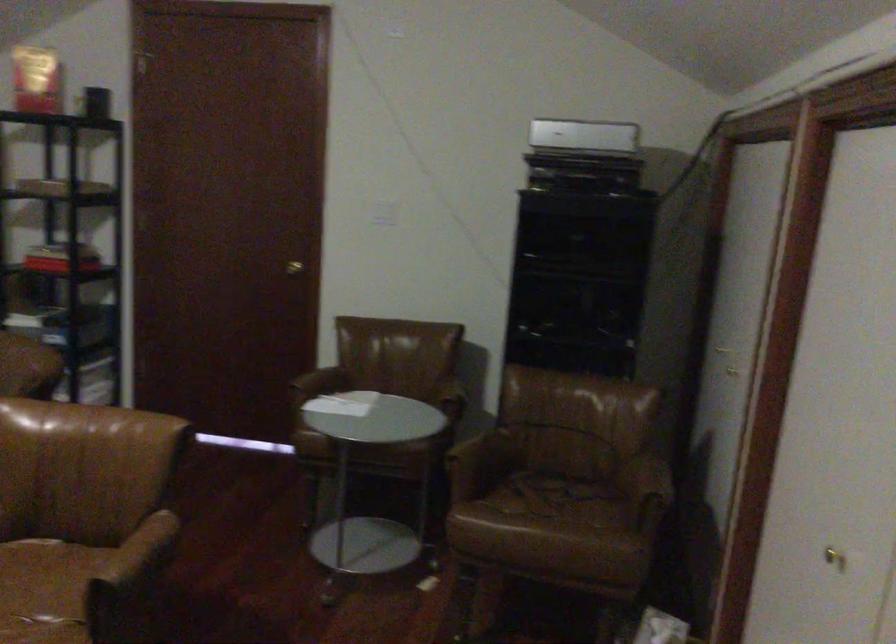
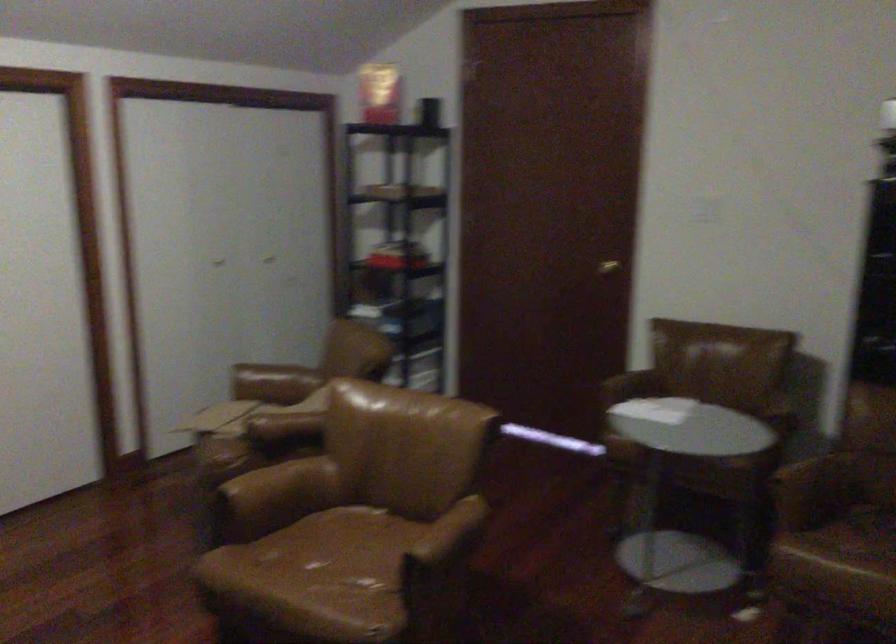
Where in the second image is the point corresponding to (147,547) from the first image?

(448, 536)